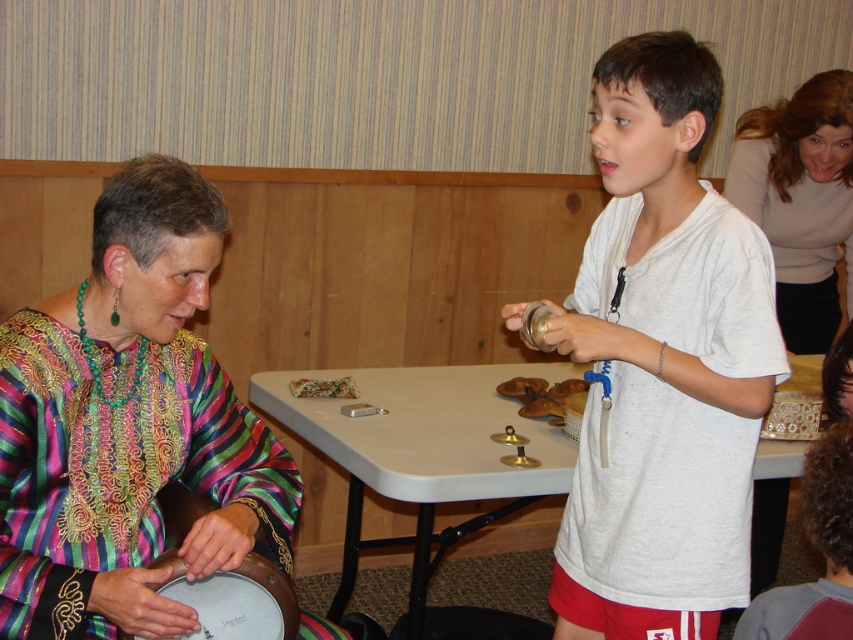
You are a photographer standing at the center of the room. You want to take a photo that includes both the point at position (x=763, y=148) and the point at position (x=827, y=465). Which point should you focus on to ensure both are in sharp focus?

You should focus on the point at position (x=763, y=148) because it is closer to the camera than the point at position (x=827, y=465). Focusing on the closer point will ensure both are in focus due to the depth of field.

You are a photographer standing in the center of the room. You need to take a photo of the white cotton shirt at center and the white plastic table at center. According to the scene description, which object is positioned higher in the frame?

The white cotton shirt at center is above the white plastic table at center, so it is positioned higher in the frame.